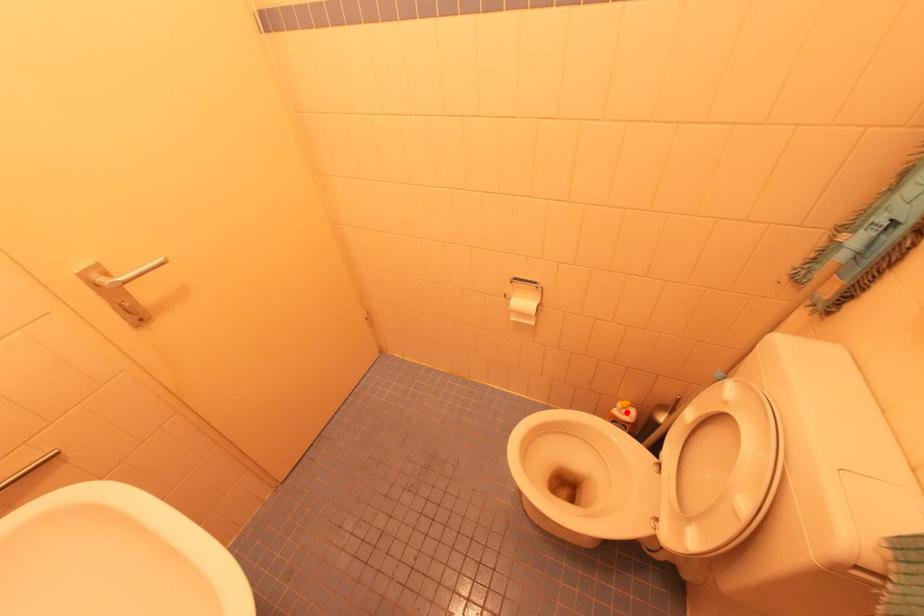
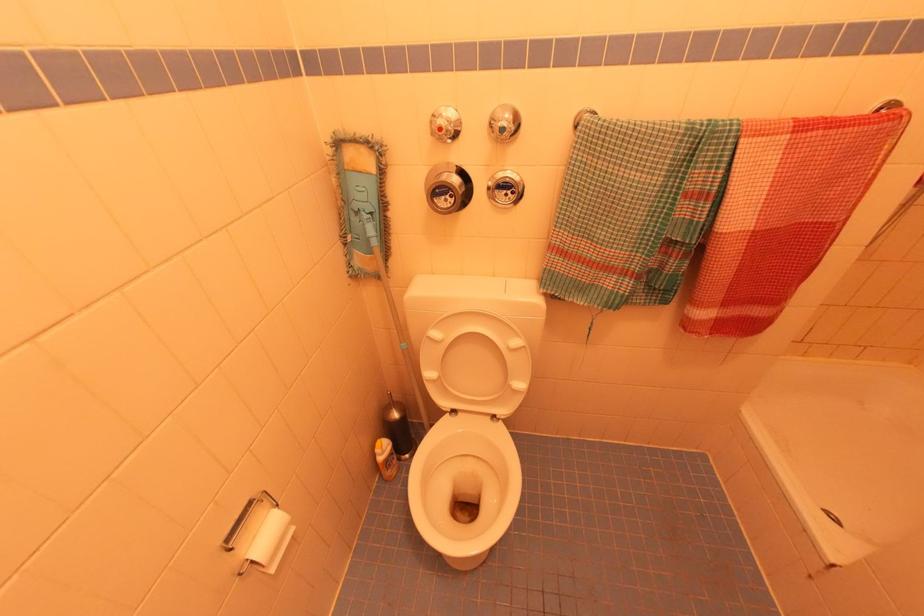
In the second image, find the point that corresponds to the highlighted location in the first image.

(385, 448)